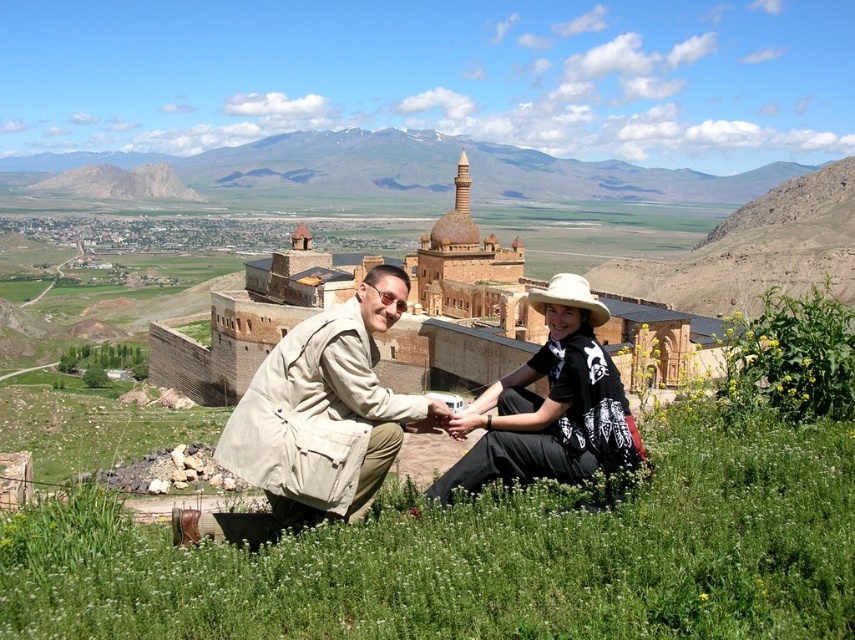
The width and height of the screenshot is (855, 640). What do you see at coordinates (484, 556) in the screenshot?
I see `green grass at lower center` at bounding box center [484, 556].

The image size is (855, 640). What are the coordinates of `green grass at lower center` in the screenshot? It's located at (484, 556).

Is point (398, 608) positioned before point (531, 410)?

Yes, it is in front of point (531, 410).

This screenshot has width=855, height=640. Find the location of `green grass at lower center`. green grass at lower center is located at coordinates click(x=484, y=556).

Does green grass at lower center have a lesser height compared to tan fabric jacket at center?

Yes.

Can you confirm if green grass at lower center is positioned to the right of tan fabric jacket at center?

Yes, green grass at lower center is to the right of tan fabric jacket at center.

What do you see at coordinates (484, 556) in the screenshot?
I see `green grass at lower center` at bounding box center [484, 556].

What are the coordinates of `green grass at lower center` in the screenshot? It's located at (484, 556).

Which is more to the right, green grass at lower center or brown stone fort at center?

green grass at lower center

In the scene shown: Does green grass at lower center have a lesser height compared to brown stone fort at center?

Yes, green grass at lower center is shorter than brown stone fort at center.

Locate an element on the screen. green grass at lower center is located at coordinates (484, 556).